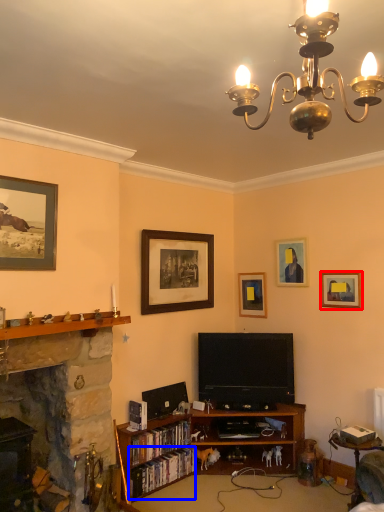
Question: Among these objects, which one is nearest to the camera, picture frame (highlighted by a red box) or book (highlighted by a blue box)?

Choices:
 (A) picture frame
 (B) book

Answer: (B)